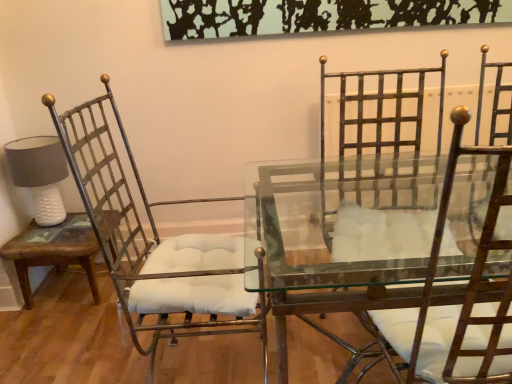
Find the location of `free spot above white textured lampshade at left (from a real-world perspective)`. free spot above white textured lampshade at left (from a real-world perspective) is located at coordinates (32, 142).